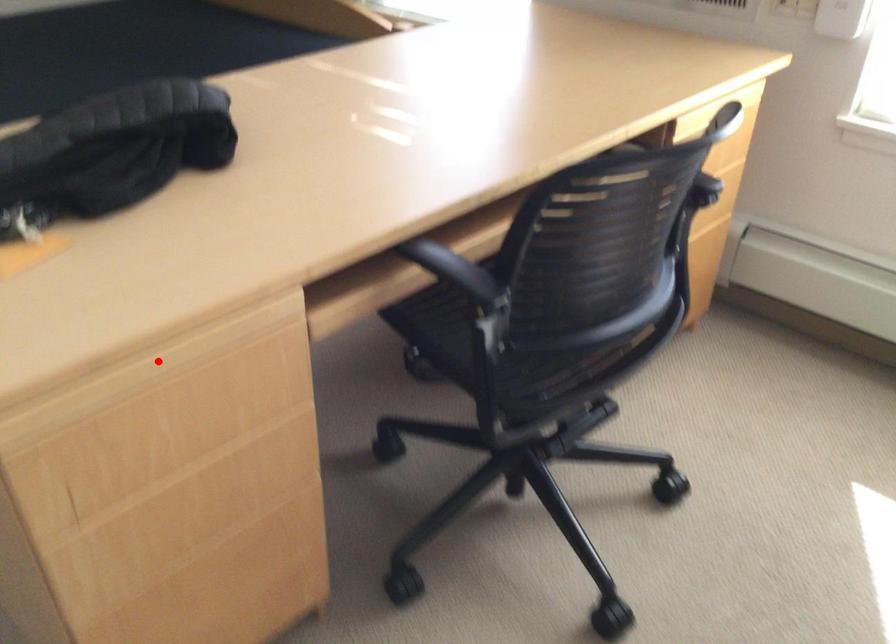
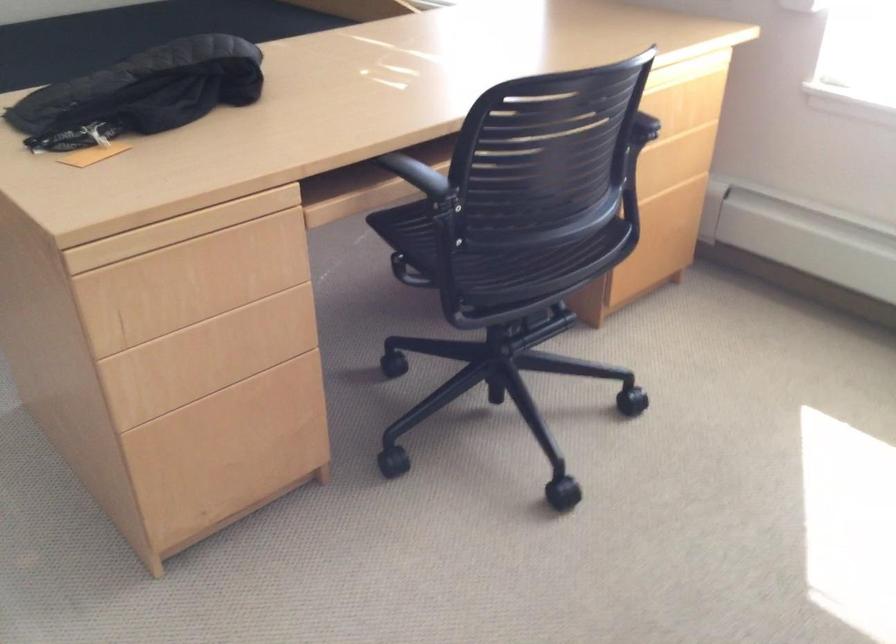
Locate, in the second image, the point that corresponds to the highlighted location in the first image.

(179, 229)